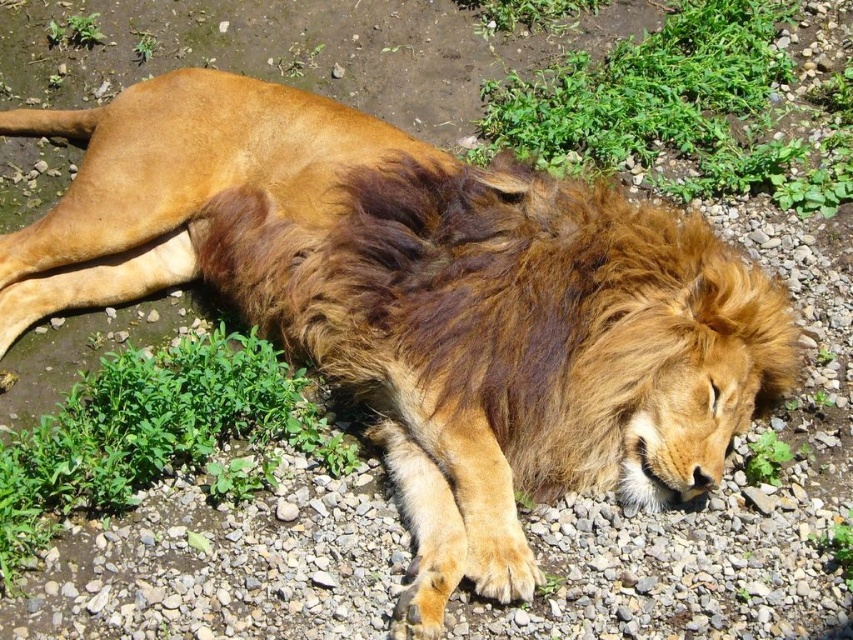
In order to click on green leafy grass at upper center in this screenshot , I will do `click(682, 109)`.

In the scene shown: Measure the distance from green leafy grass at upper center to green leafy grass at lower left.

green leafy grass at upper center is 4.81 feet away from green leafy grass at lower left.

Between point (795, 147) and point (126, 472), which one is positioned behind?

Positioned behind is point (795, 147).

The width and height of the screenshot is (853, 640). What are the coordinates of `green leafy grass at upper center` in the screenshot? It's located at (682, 109).